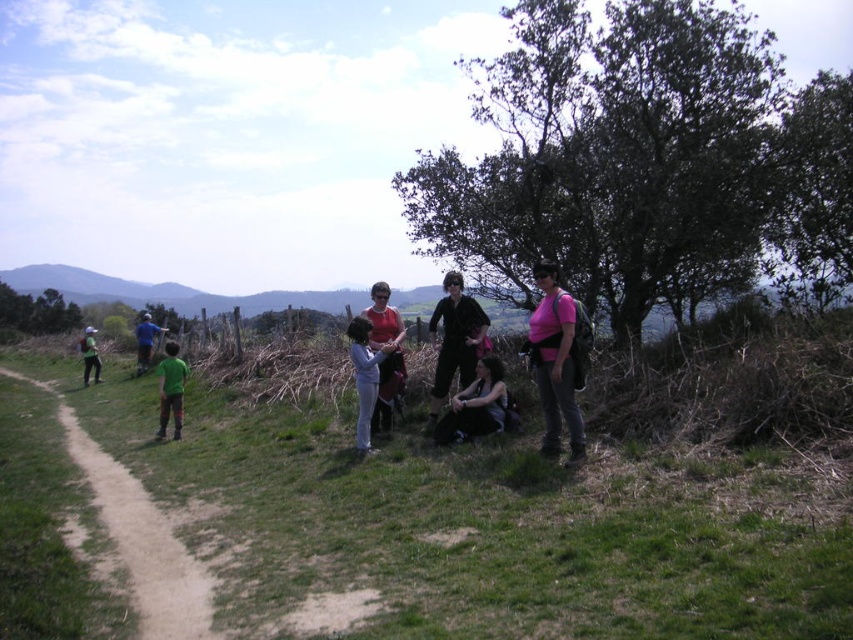
Question: Is pink fabric shirt at lower right wider than blue fabric shirt at left?

Choices:
 (A) no
 (B) yes

Answer: (B)

Question: Among these points, which one is nearest to the camera?

Choices:
 (A) (140, 336)
 (B) (457, 275)

Answer: (B)

Question: Which point is farther to the camera?

Choices:
 (A) black leather jacket at center
 (B) brown dirt path at left

Answer: (A)

Question: Which point is farther to the camera?

Choices:
 (A) (444, 348)
 (B) (149, 326)
 (C) (79, 342)

Answer: (C)

Question: Can you confirm if black leather jacket at center is positioned to the left of blue fabric shirt at left?

Choices:
 (A) no
 (B) yes

Answer: (A)

Question: Does pink fabric shirt at lower right appear under blue fabric shirt at left?

Choices:
 (A) no
 (B) yes

Answer: (B)